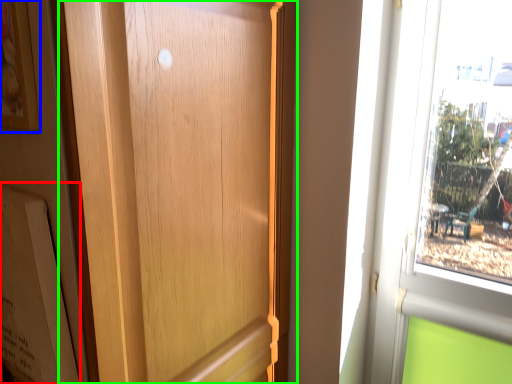
Question: Based on their relative distances, which object is nearer to bulletin board (highlighted by a red box)? Choose from picture frame (highlighted by a blue box) and door (highlighted by a green box).

Choices:
 (A) picture frame
 (B) door

Answer: (B)